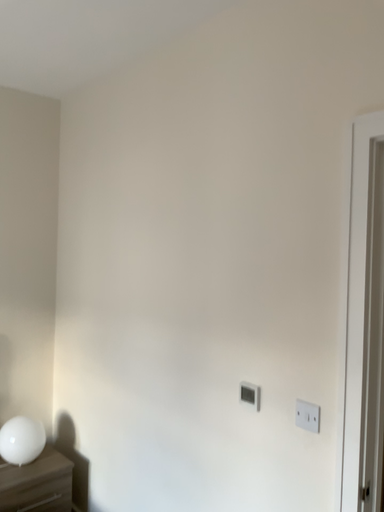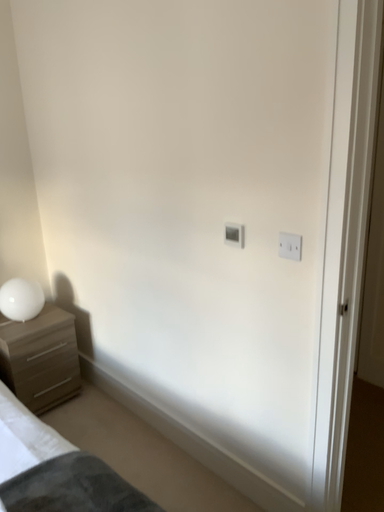
Question: Which way did the camera rotate in the video?

Choices:
 (A) rotated upward
 (B) rotated downward

Answer: (B)